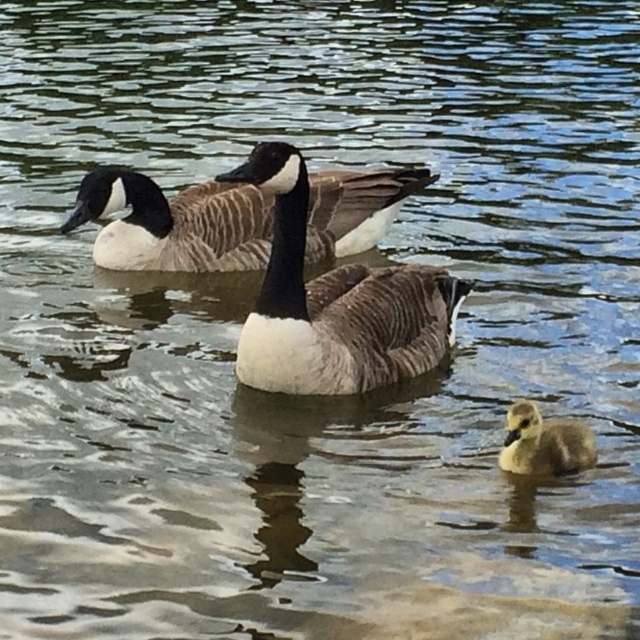
Based on the photo, is brown textured goose at center further to camera compared to brown speckled goose at upper center?

No, brown textured goose at center is closer to the viewer.

Image resolution: width=640 pixels, height=640 pixels. What do you see at coordinates (333, 304) in the screenshot?
I see `brown textured goose at center` at bounding box center [333, 304].

Does point (314, 390) come in front of point (179, 218)?

Yes, it is in front of point (179, 218).

Identify the location of brown textured goose at center. This screenshot has width=640, height=640. (333, 304).

Does point (324, 381) come closer to viewer compared to point (563, 467)?

No, (324, 381) is behind (563, 467).

The width and height of the screenshot is (640, 640). I want to click on brown textured goose at center, so click(x=333, y=304).

Is point (316, 236) closer to camera compared to point (586, 436)?

No.

Which is more to the right, brown speckled goose at upper center or soft gray downy duckling at lower right?

Positioned to the right is soft gray downy duckling at lower right.

This screenshot has width=640, height=640. I want to click on brown speckled goose at upper center, so click(x=173, y=224).